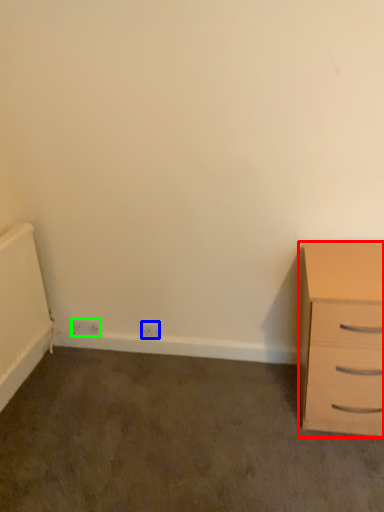
Question: Which is nearer to the chest of drawers (highlighted by a red box)? electric outlet (highlighted by a blue box) or electric outlet (highlighted by a green box).

Choices:
 (A) electric outlet
 (B) electric outlet

Answer: (A)